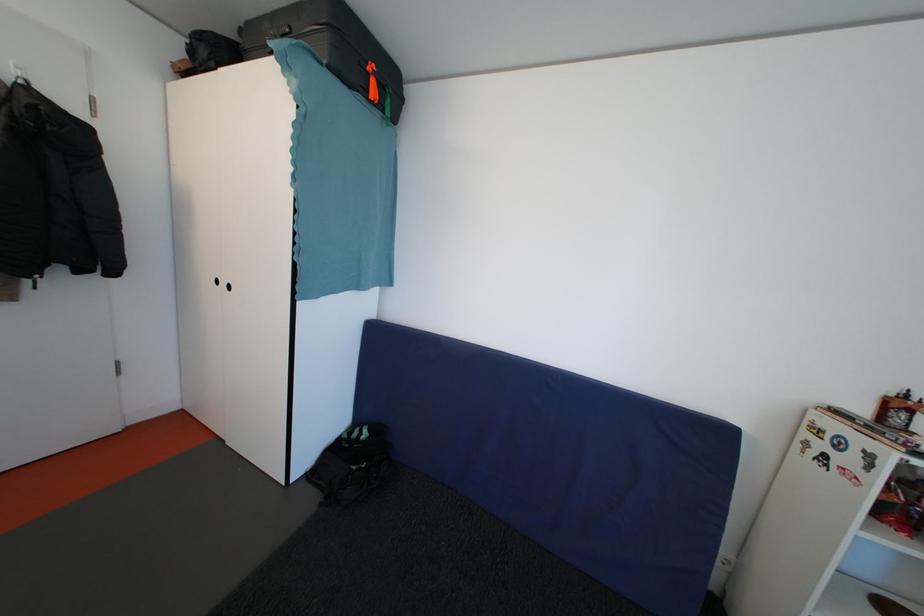
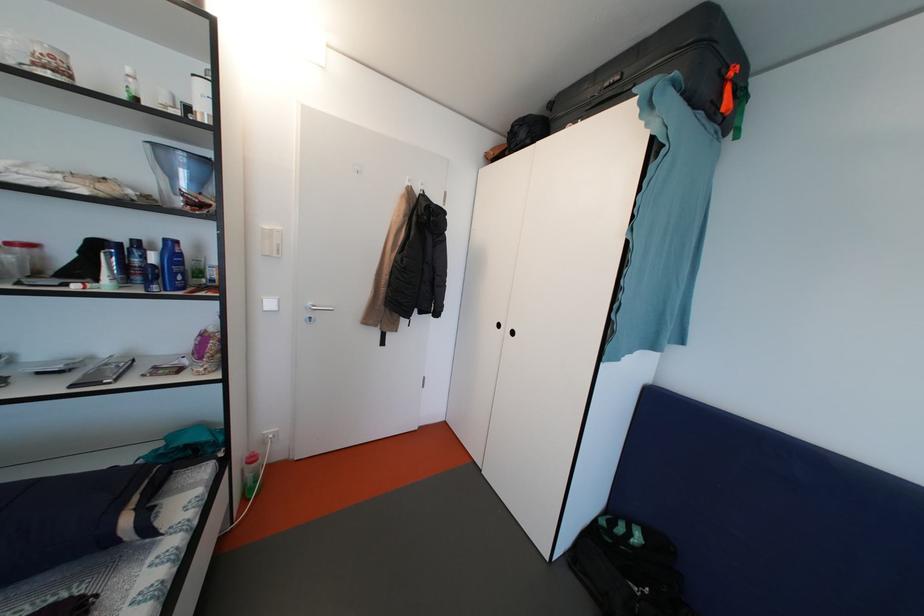
Question: The camera is either moving clockwise (left) or counter-clockwise (right) around the object. The first image is from the beginning of the video and the second image is from the end. Is the camera moving left or right when shooting the video?

Choices:
 (A) Left
 (B) Right

Answer: (B)